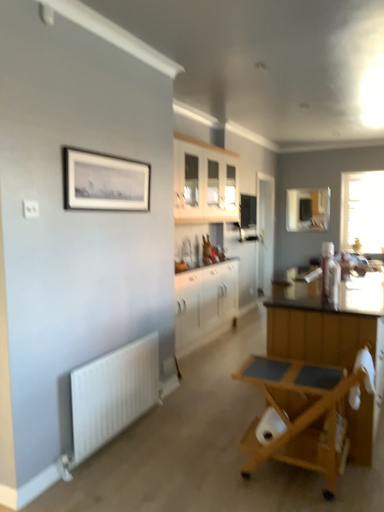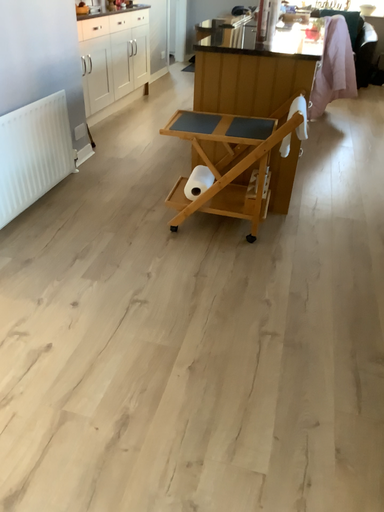
Question: Which way did the camera rotate in the video?

Choices:
 (A) rotated downward
 (B) rotated upward

Answer: (A)